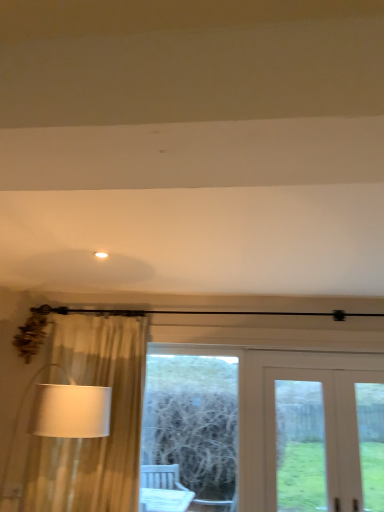
Question: Is white fabric lampshade at left oriented towards wooden frame at center?

Choices:
 (A) yes
 (B) no

Answer: (B)

Question: From a real-world perspective, does white fabric lampshade at left stand above wooden frame at center?

Choices:
 (A) yes
 (B) no

Answer: (B)

Question: Does white fabric lampshade at left appear on the left side of wooden frame at center?

Choices:
 (A) no
 (B) yes

Answer: (B)

Question: Does white fabric lampshade at left have a greater width compared to wooden frame at center?

Choices:
 (A) yes
 (B) no

Answer: (A)

Question: Is white fabric lampshade at left bigger than wooden frame at center?

Choices:
 (A) yes
 (B) no

Answer: (A)

Question: Considering the positions of white fabric lampshade at left and white wooden door at center in the image, is white fabric lampshade at left bigger or smaller than white wooden door at center?

Choices:
 (A) big
 (B) small

Answer: (A)

Question: From their relative heights in the image, would you say white fabric lampshade at left is taller or shorter than white wooden door at center?

Choices:
 (A) tall
 (B) short

Answer: (B)

Question: Is point (62, 394) closer or farther from the camera than point (331, 392)?

Choices:
 (A) farther
 (B) closer

Answer: (B)

Question: From the image's perspective, is white fabric lampshade at left located above or below white wooden door at center?

Choices:
 (A) above
 (B) below

Answer: (A)

Question: Is white matte light fixture at upper center to the left or to the right of white fabric lampshade at left in the image?

Choices:
 (A) left
 (B) right

Answer: (B)

Question: In terms of width, does white matte light fixture at upper center look wider or thinner when compared to white fabric lampshade at left?

Choices:
 (A) thin
 (B) wide

Answer: (A)

Question: Is white matte light fixture at upper center inside the boundaries of white fabric lampshade at left, or outside?

Choices:
 (A) inside
 (B) outside

Answer: (B)

Question: From the image's perspective, is white matte light fixture at upper center positioned above or below white fabric lampshade at left?

Choices:
 (A) below
 (B) above

Answer: (B)

Question: Considering the positions of white wooden door at center and white fabric lampshade at left in the image, is white wooden door at center taller or shorter than white fabric lampshade at left?

Choices:
 (A) tall
 (B) short

Answer: (A)

Question: From the image's perspective, is white wooden door at center located above or below white fabric lampshade at left?

Choices:
 (A) below
 (B) above

Answer: (A)